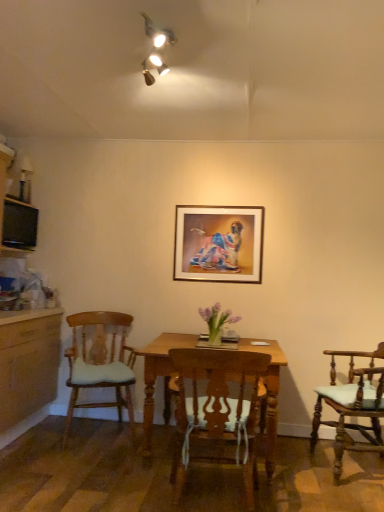
Question: Is wooden chair with cushion at right, acting as the third chair starting from the left, to the right of wooden chair with cushion at left, placed as the 1th chair when sorted from left to right, from the viewer's perspective?

Choices:
 (A) no
 (B) yes

Answer: (B)

Question: Does wooden chair with cushion at right, which is the 1th chair from right to left, contain wooden chair with cushion at left, placed as the 1th chair when sorted from left to right?

Choices:
 (A) no
 (B) yes

Answer: (A)

Question: Is wooden chair with cushion at right, acting as the third chair starting from the left, completely or partially outside of wooden chair with cushion at left, arranged as the third chair when viewed from the right?

Choices:
 (A) yes
 (B) no

Answer: (A)

Question: Considering the relative positions of wooden chair with cushion at right, acting as the third chair starting from the left, and wooden chair with cushion at left, arranged as the third chair when viewed from the right, in the image provided, is wooden chair with cushion at right, acting as the third chair starting from the left, in front of wooden chair with cushion at left, arranged as the third chair when viewed from the right,?

Choices:
 (A) yes
 (B) no

Answer: (A)

Question: From a real-world perspective, is wooden chair with cushion at right, which is the 1th chair from right to left, positioned under wooden chair with cushion at left, placed as the 1th chair when sorted from left to right, based on gravity?

Choices:
 (A) no
 (B) yes

Answer: (B)

Question: From the image's perspective, relative to wooden chair with cushion at right, acting as the third chair starting from the left, is black glossy television at left above or below?

Choices:
 (A) below
 (B) above

Answer: (B)

Question: Is black glossy television at left bigger or smaller than wooden chair with cushion at right, acting as the third chair starting from the left?

Choices:
 (A) big
 (B) small

Answer: (B)

Question: Relative to wooden chair with cushion at right, which is the 1th chair from right to left, is black glossy television at left in front or behind?

Choices:
 (A) front
 (B) behind

Answer: (B)

Question: In terms of width, does black glossy television at left look wider or thinner when compared to wooden chair with cushion at right, which is the 1th chair from right to left?

Choices:
 (A) wide
 (B) thin

Answer: (B)

Question: From the image's perspective, relative to gold-framed picture at center, is wooden chair at center, positioned as the second chair in right-to-left order, above or below?

Choices:
 (A) below
 (B) above

Answer: (A)

Question: From their relative heights in the image, would you say wooden chair at center, the second chair from the left, is taller or shorter than gold-framed picture at center?

Choices:
 (A) short
 (B) tall

Answer: (B)

Question: In the image, is wooden chair at center, positioned as the second chair in right-to-left order, on the left side or the right side of gold-framed picture at center?

Choices:
 (A) right
 (B) left

Answer: (B)

Question: Relative to gold-framed picture at center, is wooden chair at center, the second chair from the left, in front or behind?

Choices:
 (A) behind
 (B) front

Answer: (B)

Question: Looking at their shapes, would you say wooden chair with cushion at left, arranged as the third chair when viewed from the right, is wider or thinner than wooden chair with cushion at right, acting as the third chair starting from the left?

Choices:
 (A) wide
 (B) thin

Answer: (A)

Question: From their relative heights in the image, would you say wooden chair with cushion at left, placed as the 1th chair when sorted from left to right, is taller or shorter than wooden chair with cushion at right, acting as the third chair starting from the left?

Choices:
 (A) tall
 (B) short

Answer: (A)